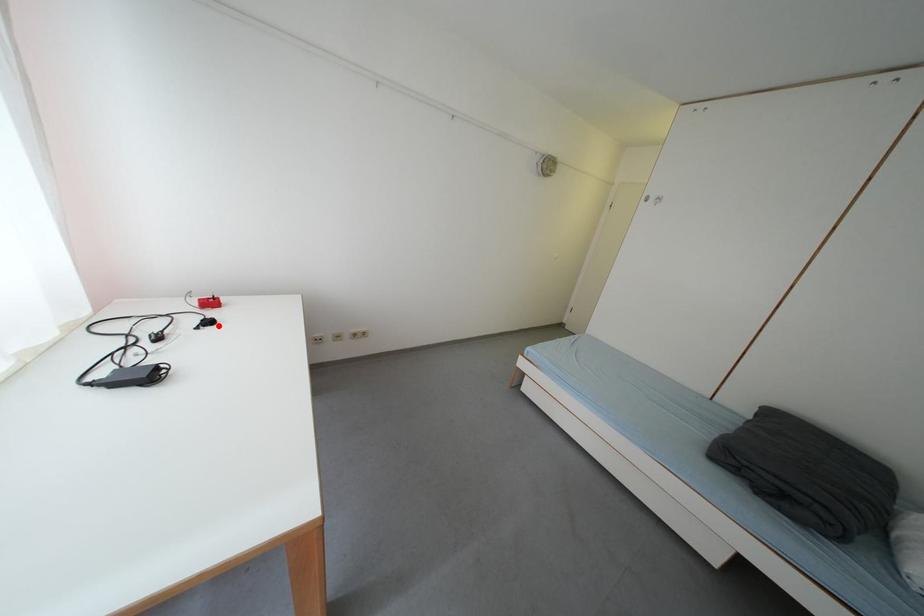
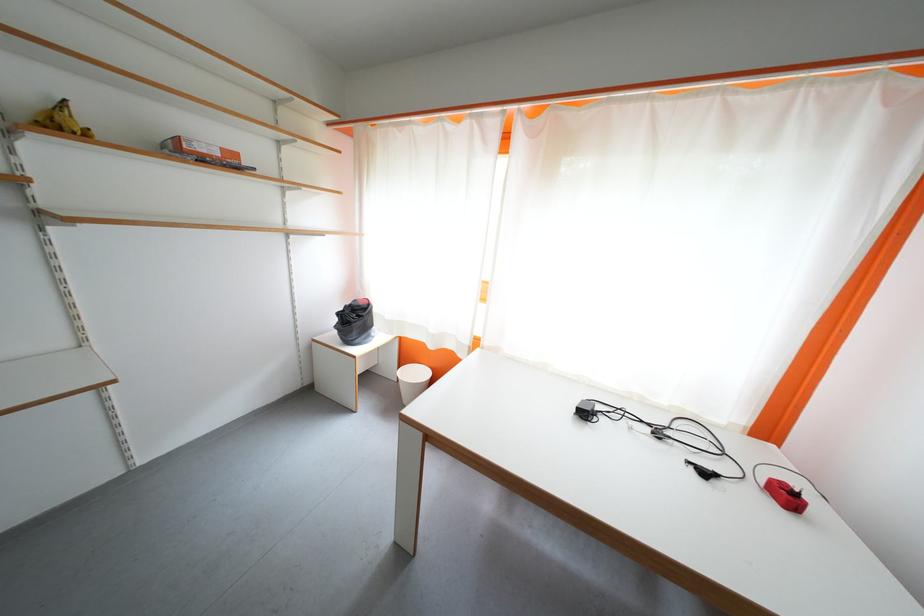
In the second image, find the point that corresponds to the highlighted location in the first image.

(713, 477)